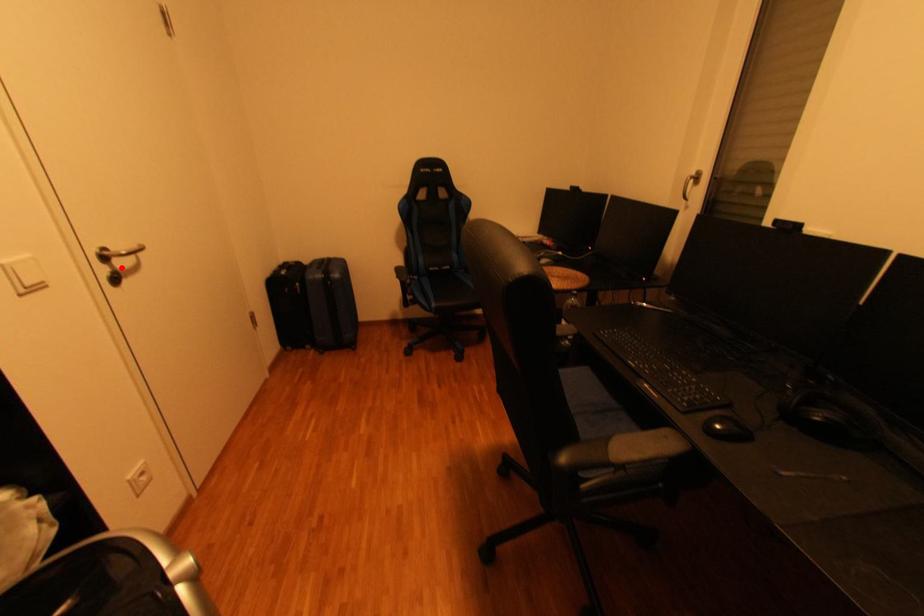
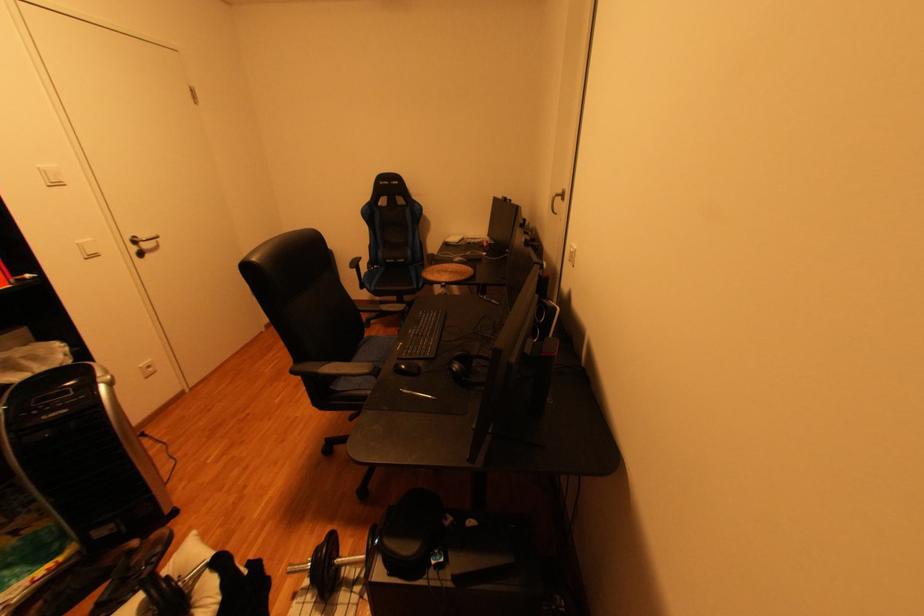
The point at the highlighted location is marked in the first image. Where is the corresponding point in the second image?

(150, 248)